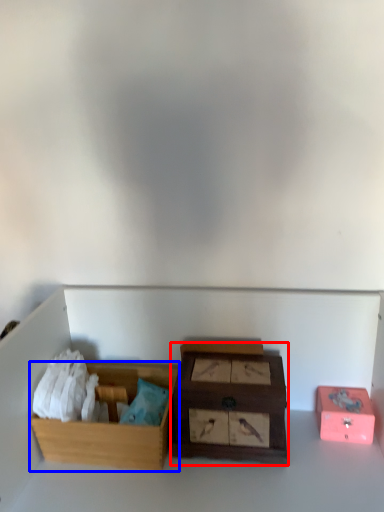
Question: Which object is closer to the camera taking this photo, box (highlighted by a red box) or box (highlighted by a blue box)?

Choices:
 (A) box
 (B) box

Answer: (A)